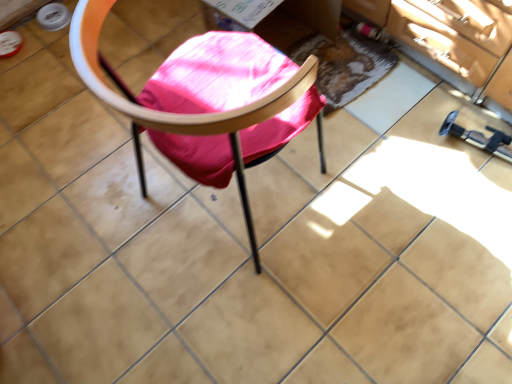
What do you see at coordinates (200, 117) in the screenshot?
I see `wooden chair at center` at bounding box center [200, 117].

The width and height of the screenshot is (512, 384). In order to click on wooden chair at center in this screenshot , I will do `click(200, 117)`.

In order to face wooden chair at center, should I rotate leftwards or rightwards?

You should rotate left by 3.877 degrees.

Measure the distance between point (375, 57) and camera.

Point (375, 57) and camera are 5.25 feet apart.

Where is `textured woolen mat at center`? The image size is (512, 384). textured woolen mat at center is located at coordinates (345, 64).

This screenshot has height=384, width=512. What do you see at coordinates (345, 64) in the screenshot?
I see `textured woolen mat at center` at bounding box center [345, 64].

Where is `wooden chair at center`? wooden chair at center is located at coordinates (200, 117).

Which object is positioned more to the right, textured woolen mat at center or wooden chair at center?

textured woolen mat at center.

In the image, is textured woolen mat at center positioned in front of or behind wooden chair at center?

In the image, textured woolen mat at center appears behind wooden chair at center.

Between point (353, 37) and point (209, 126), which one is positioned behind?

The point (353, 37) is behind.

From the image's perspective, is textured woolen mat at center under wooden chair at center?

No.

From a real-world perspective, is textured woolen mat at center above or below wooden chair at center?

Clearly, from a real-world perspective, textured woolen mat at center is below wooden chair at center.

Which object is thinner, textured woolen mat at center or wooden chair at center?

textured woolen mat at center.

Is textured woolen mat at center taller than wooden chair at center?

Incorrect, the height of textured woolen mat at center is not larger of that of wooden chair at center.

Which of these two, textured woolen mat at center or wooden chair at center, is bigger?

wooden chair at center.

Is textured woolen mat at center located outside wooden chair at center?

That's correct, textured woolen mat at center is outside of wooden chair at center.

Is textured woolen mat at center not near wooden chair at center?

No, there isn't a large distance between textured woolen mat at center and wooden chair at center.

Is wooden chair at center at the back of textured woolen mat at center?

No.

Can you tell me how much textured woolen mat at center and wooden chair at center differ in facing direction?

160 degrees.

I want to click on mat above the wooden chair at center (from the image's perspective), so click(345, 64).

Is wooden chair at center at the left side of textured woolen mat at center?

Yes.

Which object is further away from the camera, wooden chair at center or textured woolen mat at center?

Positioned behind is textured woolen mat at center.

Considering the positions of points (90, 13) and (364, 83), is point (90, 13) closer to camera compared to point (364, 83)?

Yes, it is in front of point (364, 83).

From the image's perspective, is wooden chair at center on textured woolen mat at center?

No, from the image's perspective, wooden chair at center is not over textured woolen mat at center.

From a real-world perspective, is wooden chair at center positioned above or below textured woolen mat at center?

wooden chair at center is situated higher than textured woolen mat at center in the real world.

Consider the image. Considering the relative sizes of wooden chair at center and textured woolen mat at center in the image provided, is wooden chair at center wider than textured woolen mat at center?

Yes.

Between wooden chair at center and textured woolen mat at center, which one has more height?

Standing taller between the two is wooden chair at center.

Which of these two, wooden chair at center or textured woolen mat at center, is smaller?

Smaller between the two is textured woolen mat at center.

Would you say wooden chair at center is inside or outside textured woolen mat at center?

wooden chair at center lies outside textured woolen mat at center.

Is wooden chair at center placed right next to textured woolen mat at center?

wooden chair at center and textured woolen mat at center are not in contact.

Is wooden chair at center positioned with its back to textured woolen mat at center?

No.

Can you tell me how much wooden chair at center and textured woolen mat at center differ in facing direction?

They differ by 160 degrees in their facing directions.

This screenshot has height=384, width=512. I want to click on mat that is on the right side of wooden chair at center, so click(x=345, y=64).

Identify the location of chair that is below the textured woolen mat at center (from the image's perspective). (200, 117).

The height and width of the screenshot is (384, 512). I want to click on mat below the wooden chair at center (from a real-world perspective), so click(345, 64).